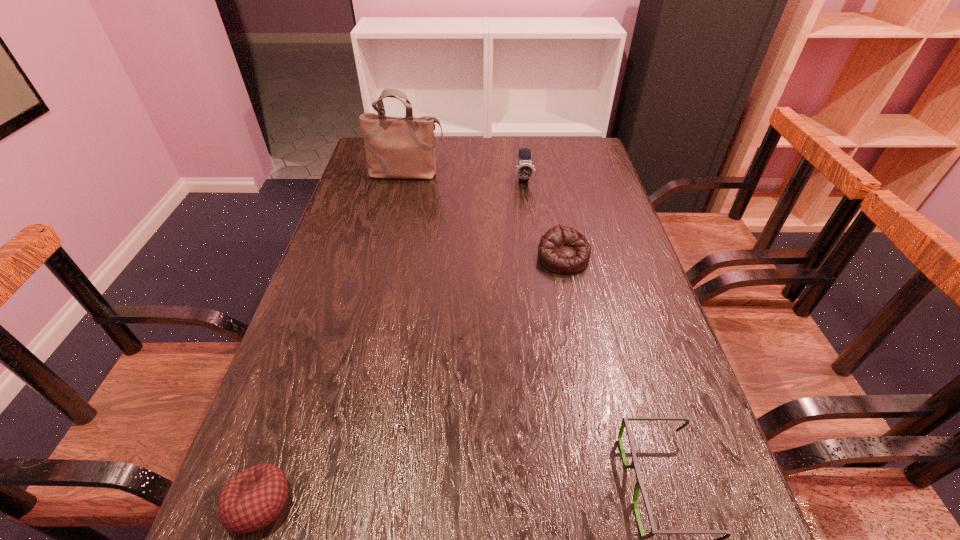
What are the coordinates of `shoulder bag` in the screenshot? It's located at (400, 148).

Identify the location of watch. (525, 169).

The image size is (960, 540). Identify the location of the farther beanbag. (562, 249).

At what (x,y) coordinates should I click in order to perform the action: click on the third farthest object. Please return your answer as a coordinate pair (x, y). The image size is (960, 540). Looking at the image, I should click on (562, 249).

Image resolution: width=960 pixels, height=540 pixels. I want to click on the left beanbag, so click(254, 498).

The height and width of the screenshot is (540, 960). I want to click on vacant region located 0.340m on the front-facing side of the shoulder bag, so click(389, 253).

This screenshot has height=540, width=960. In order to click on free spot located 0.260m on the face of the second tallest object in this screenshot , I will do `click(532, 239)`.

Identify the location of free space located on the right of the right beanbag. (636, 258).

What are the coordinates of `vacant space located 0.390m on the right of the nearer beanbag` in the screenshot? It's located at (532, 503).

Find the location of a particular element. The height and width of the screenshot is (540, 960). shoulder bag situated at the far edge is located at coordinates (400, 148).